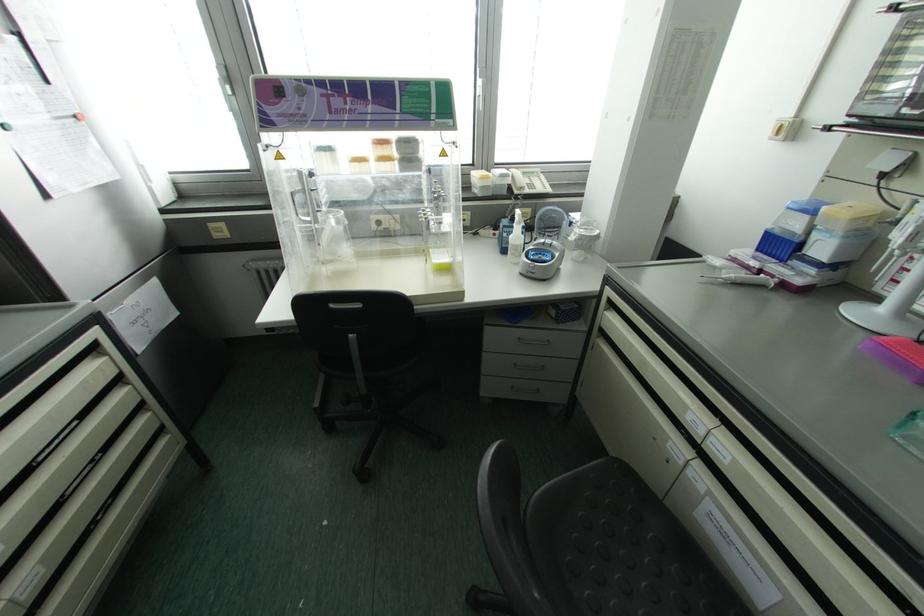
This screenshot has height=616, width=924. What do you see at coordinates (529, 366) in the screenshot? I see `the recessed drawer handle` at bounding box center [529, 366].